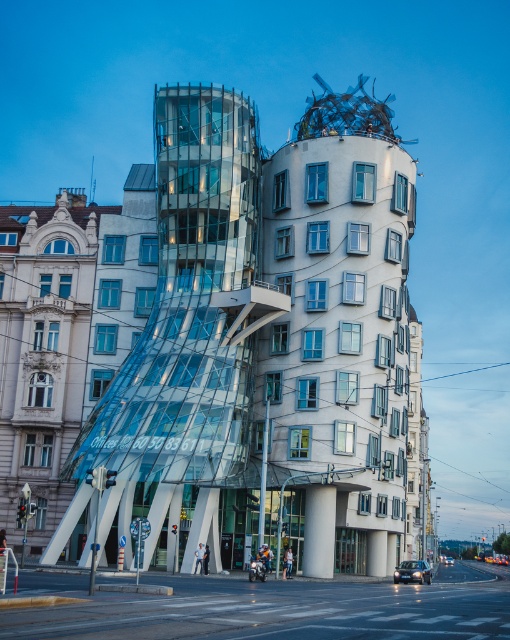
You are an architect analyzing the Dancing House in Prague. You notice the transparent glass building at center and the white smooth pillar at center. Which one is positioned higher in the structure?

The transparent glass building at center is positioned higher than the white smooth pillar at center because it is located above it.

You are standing in front of the Dancing House in Prague. You want to take a photo of the transparent glass building at center. If your camera can focus on objects up to 50 meters away, will it be able to capture the building clearly?

The transparent glass building at center is 60.70 meters away from the camera. Since the camera can only focus up to 50 meters, it will not be able to capture the building clearly.

You are standing in front of the Dancing House in Prague and notice two points marked on the building. The first point is at coordinates point (322, 161) and the second is at point (318, 552). Which point is closer to your viewpoint?

Point (322, 161) is further to the camera than point (318, 552), so the point closer to your viewpoint is point (318, 552).